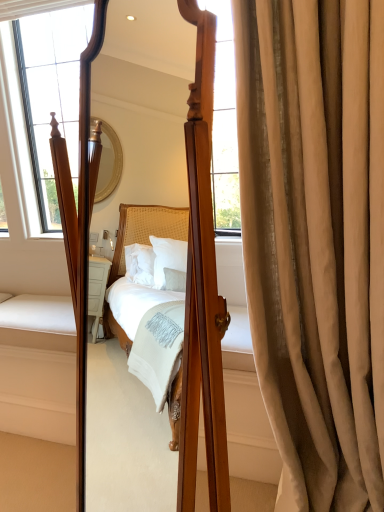
What is the approximate height of satin beige curtain at right?

It is 1.62 meters.

You are a GUI agent. You are given a task and a screenshot of the screen. Output one action in this format:
    pyautogui.click(x=<x>, y=<y>)
    Task: Click on the satin beige curtain at right
    
    Given the screenshot: What is the action you would take?
    pyautogui.click(x=315, y=239)

This screenshot has height=512, width=384. What do you see at coordinates (315, 239) in the screenshot?
I see `satin beige curtain at right` at bounding box center [315, 239].

Describe the element at coordinates (201, 289) in the screenshot. I see `wooden mirror at center` at that location.

Locate an element on the screen. This screenshot has height=512, width=384. wooden mirror at center is located at coordinates (201, 289).

Locate an element on the screen. Image resolution: width=384 pixels, height=512 pixels. satin beige curtain at right is located at coordinates (315, 239).

Considering the positions of objects satin beige curtain at right and wooden mirror at center in the image provided, who is more to the left, satin beige curtain at right or wooden mirror at center?

From the viewer's perspective, wooden mirror at center appears more on the left side.

Considering the positions of objects satin beige curtain at right and wooden mirror at center in the image provided, who is in front, satin beige curtain at right or wooden mirror at center?

wooden mirror at center.

Which is in front, point (310, 22) or point (194, 294)?

The point (194, 294) is in front.

From the image's perspective, which one is positioned lower, satin beige curtain at right or wooden mirror at center?

wooden mirror at center is shown below in the image.

From a real-world perspective, is satin beige curtain at right over wooden mirror at center?

Actually, satin beige curtain at right is physically below wooden mirror at center in the real world.

Looking at this image, between satin beige curtain at right and wooden mirror at center, which one has larger width?

wooden mirror at center.

Which of these two, satin beige curtain at right or wooden mirror at center, stands taller?

satin beige curtain at right is taller.

From the picture: Looking at the image, does satin beige curtain at right seem bigger or smaller compared to wooden mirror at center?

Considering their sizes, satin beige curtain at right takes up less space than wooden mirror at center.

Is wooden mirror at center completely or partially inside satin beige curtain at right?

No, satin beige curtain at right does not contain wooden mirror at center.

Is satin beige curtain at right not near wooden mirror at center?

No, satin beige curtain at right is in close proximity to wooden mirror at center.

Does satin beige curtain at right turn towards wooden mirror at center?

No, satin beige curtain at right is not turned towards wooden mirror at center.

Consider the image. What's the angular difference between satin beige curtain at right and wooden mirror at center's facing directions?

The angle between the facing direction of satin beige curtain at right and the facing direction of wooden mirror at center is 64.4 degrees.

Where is `curtain located on the right of wooden mirror at center`? The width and height of the screenshot is (384, 512). curtain located on the right of wooden mirror at center is located at coordinates pyautogui.click(x=315, y=239).

Does wooden mirror at center appear on the left side of satin beige curtain at right?

Yes, wooden mirror at center is to the left of satin beige curtain at right.

Which object is further away from the camera taking this photo, wooden mirror at center or satin beige curtain at right?

satin beige curtain at right is further away from the camera.

Is point (207, 322) positioned in front of point (338, 474)?

Yes, it is.

From the image's perspective, relative to satin beige curtain at right, is wooden mirror at center above or below?

Clearly, from the image's perspective, wooden mirror at center is below satin beige curtain at right.

From a real-world perspective, is wooden mirror at center physically located above or below satin beige curtain at right?

wooden mirror at center is above satin beige curtain at right.

Can you confirm if wooden mirror at center is thinner than satin beige curtain at right?

No.

From their relative heights in the image, would you say wooden mirror at center is taller or shorter than satin beige curtain at right?

Considering their sizes, wooden mirror at center has less height than satin beige curtain at right.

Does wooden mirror at center have a smaller size compared to satin beige curtain at right?

Actually, wooden mirror at center might be larger than satin beige curtain at right.

Can satin beige curtain at right be found inside wooden mirror at center?

No, satin beige curtain at right is not inside wooden mirror at center.

Are wooden mirror at center and satin beige curtain at right making contact?

No, wooden mirror at center is not in contact with satin beige curtain at right.

Is wooden mirror at center facing towards satin beige curtain at right?

No.

The height and width of the screenshot is (512, 384). I want to click on mirror in front of the satin beige curtain at right, so click(201, 289).

In the image, there is a wooden mirror at center. Where is `curtain below it (from a real-world perspective)`? This screenshot has width=384, height=512. curtain below it (from a real-world perspective) is located at coordinates (315, 239).

Where is `mirror in front of the satin beige curtain at right`? The image size is (384, 512). mirror in front of the satin beige curtain at right is located at coordinates (201, 289).